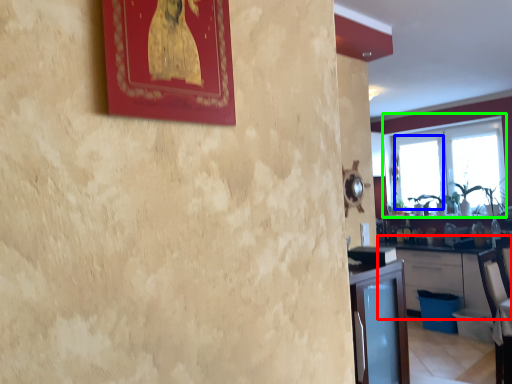
Question: Which object is the farthest from cabinetry (highlighted by a red box)? Choose among these: window (highlighted by a blue box) or window (highlighted by a green box).

Choices:
 (A) window
 (B) window

Answer: (B)